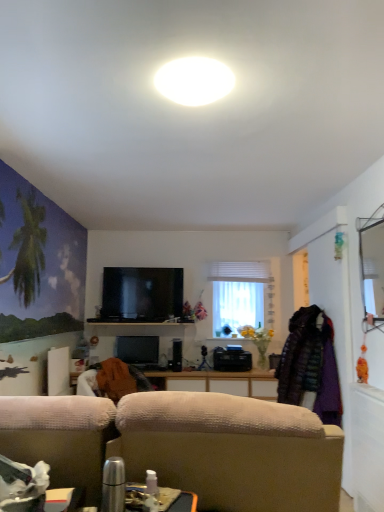
Question: From the image's perspective, is white sheer curtain at center located above or below white glossy ceiling light at upper center?

Choices:
 (A) below
 (B) above

Answer: (A)

Question: Is white sheer curtain at center spatially inside white glossy ceiling light at upper center, or outside of it?

Choices:
 (A) outside
 (B) inside

Answer: (A)

Question: Which of these objects is positioned farthest from the white sheer curtain at center?

Choices:
 (A) white glossy ceiling light at upper center
 (B) black glossy flat-screen tv at center, which appears as the second television when ordered from the bottom
 (C) black glossy television at center, which is counted as the first television, starting from the bottom

Answer: (A)

Question: Which is farther from the white sheer curtain at center?

Choices:
 (A) black glossy flat-screen tv at center, which appears as the second television when ordered from the bottom
 (B) black glossy television at center, which is counted as the first television, starting from the bottom
 (C) white glossy ceiling light at upper center

Answer: (C)